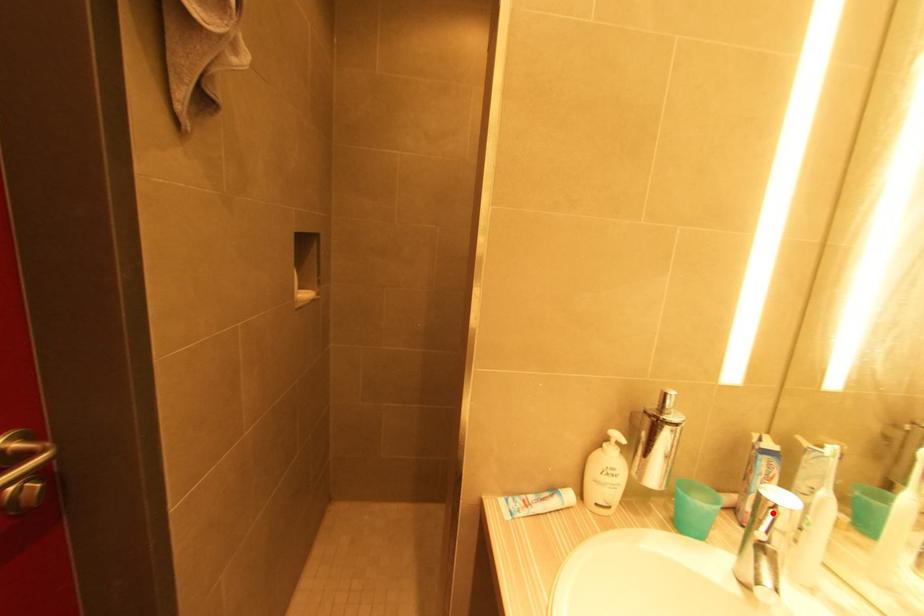
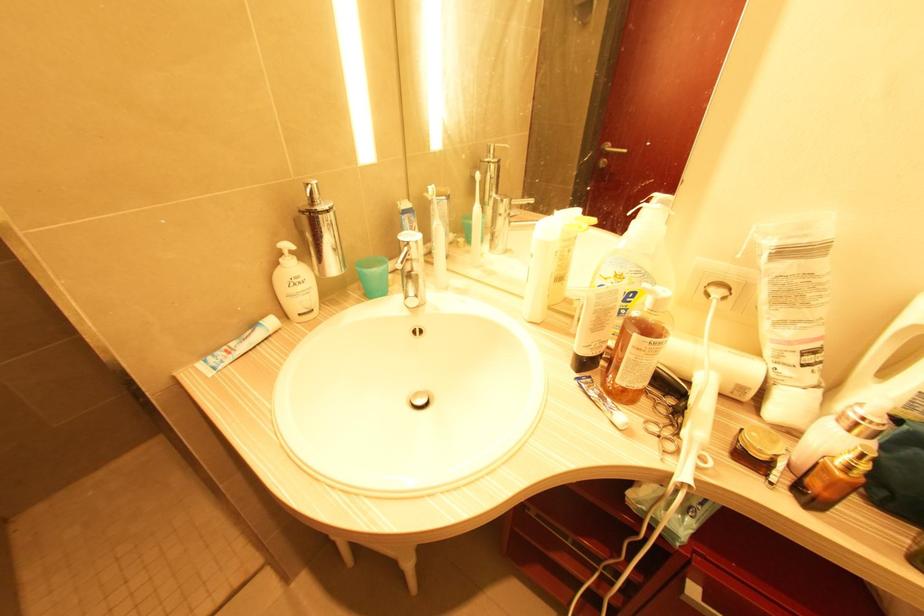
Find the pixel in the second image that matches the highlighted location in the first image.

(407, 249)